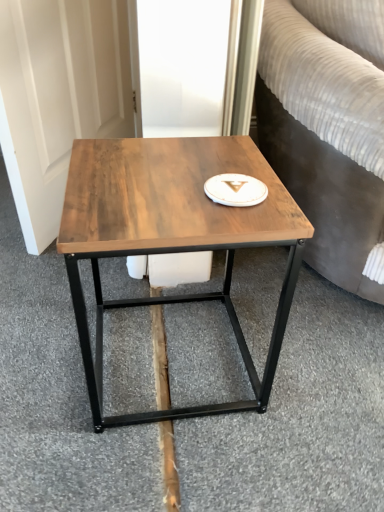
Question: Looking at their shapes, would you say white glossy platter at center is wider or thinner than wooden table at center?

Choices:
 (A) wide
 (B) thin

Answer: (B)

Question: Is white glossy platter at center to the left or to the right of wooden table at center in the image?

Choices:
 (A) right
 (B) left

Answer: (A)

Question: Which of these objects is positioned farthest from the wooden table at center?

Choices:
 (A) white glossy platter at center
 (B) brown wood plank at center

Answer: (B)

Question: Estimate the real-world distances between objects in this image. Which object is closer to the brown wood plank at center?

Choices:
 (A) wooden table at center
 (B) white glossy platter at center

Answer: (A)